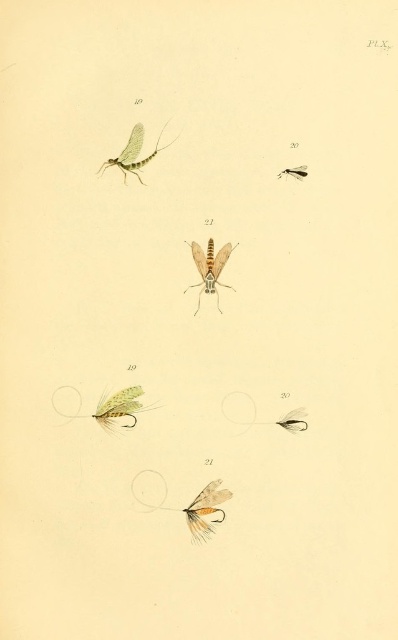
You are examining the scientific illustration and notice a translucent white feather at bottom center. Where exactly is this feather positioned in relation to the numbered insect drawings?

The translucent white feather at bottom center is located at point (191,506), which places it precisely in the bottom center area relative to the numbered insect drawings.

You are examining an entomology page with a vintage background. There is a point marked at coordinates [220,515]. If you want to place a magnifying glass exactly 4 feet away from this point towards the viewer, will it overlap with any other elements on the page?

The point at [220,515] is 4.34 feet away from the viewer. Placing the magnifying glass 4 feet from this point towards the viewer would result in a total distance of 0.34 feet from the viewer, which may overlap with other elements depending on their proximity, but since no other elements are mentioned in the scene description, it should be safe.